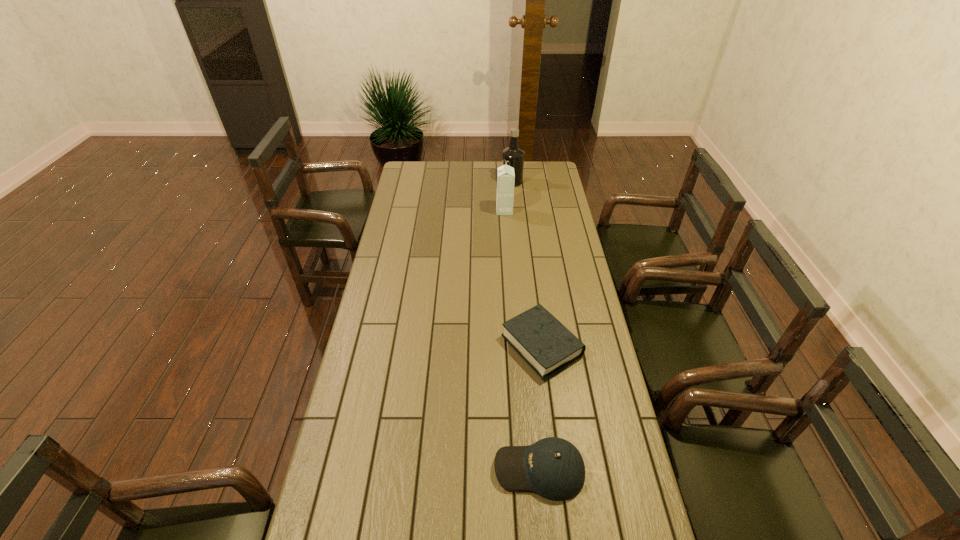
You are a GUI agent. You are given a task and a screenshot of the screen. Output one action in this format:
    pyautogui.click(x=<x>, y=<y>)
    Task: Click on the vacant space that satisfies the following two spatial constraints: 1. on the front side of the Bible; 2. on the front-facing side of the nearest object
    The width and height of the screenshot is (960, 540).
    Given the screenshot: What is the action you would take?
    pyautogui.click(x=558, y=469)